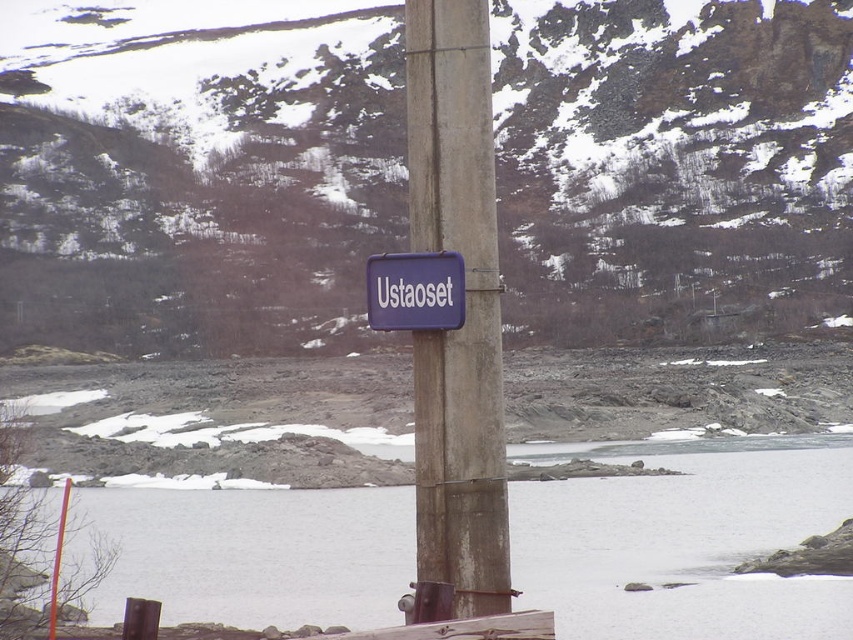
Based on the photo, is matte gray rock at center to the left of white ice at lower center from the viewer's perspective?

No, matte gray rock at center is not to the left of white ice at lower center.

Who is more forward, (x=619, y=20) or (x=582, y=598)?

Point (x=582, y=598) is in front.

Image resolution: width=853 pixels, height=640 pixels. In order to click on matte gray rock at center in this screenshot , I will do `click(196, 172)`.

Is matte gray rock at center wider than purple matte sign at center?

Indeed, matte gray rock at center has a greater width compared to purple matte sign at center.

Does matte gray rock at center appear over purple matte sign at center?

Yes, matte gray rock at center is above purple matte sign at center.

Who is more forward, (233, 108) or (416, 296)?

Point (416, 296) is in front.

Image resolution: width=853 pixels, height=640 pixels. What are the coordinates of `matte gray rock at center` in the screenshot? It's located at (196, 172).

Who is higher up, rusty concrete pole at center or purple matte sign at center?

Positioned higher is purple matte sign at center.

Is point (480, 342) farther from camera compared to point (428, 289)?

Yes, point (480, 342) is behind point (428, 289).

At what (x,y) coordinates should I click in order to perform the action: click on rusty concrete pole at center. Please return your answer as a coordinate pair (x, y). Image resolution: width=853 pixels, height=640 pixels. Looking at the image, I should click on (465, 308).